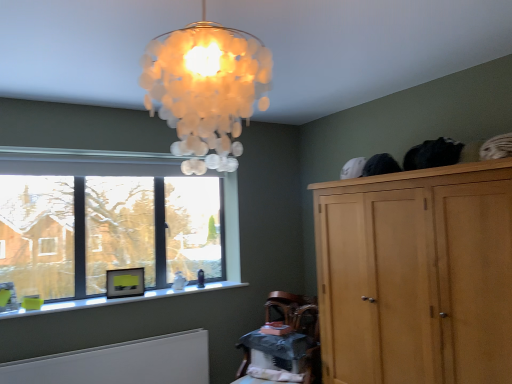
Question: From the image's perspective, does clear glass window at lower left appear lower than wooden armchair at lower center?

Choices:
 (A) yes
 (B) no

Answer: (B)

Question: Could you tell me if clear glass window at lower left is facing wooden armchair at lower center?

Choices:
 (A) yes
 (B) no

Answer: (B)

Question: Can we say clear glass window at lower left lies outside wooden armchair at lower center?

Choices:
 (A) no
 (B) yes

Answer: (B)

Question: From the image's perspective, is clear glass window at lower left on top of wooden armchair at lower center?

Choices:
 (A) yes
 (B) no

Answer: (A)

Question: Is clear glass window at lower left further to camera compared to wooden armchair at lower center?

Choices:
 (A) no
 (B) yes

Answer: (A)

Question: Would you say clear glass window at lower left is to the left or to the right of wooden armchair at lower center in the picture?

Choices:
 (A) left
 (B) right

Answer: (A)

Question: Is clear glass window at lower left inside the boundaries of wooden armchair at lower center, or outside?

Choices:
 (A) outside
 (B) inside

Answer: (A)

Question: From the image's perspective, is clear glass window at lower left positioned above or below wooden armchair at lower center?

Choices:
 (A) below
 (B) above

Answer: (B)

Question: Is point (39, 185) positioned closer to the camera than point (266, 299)?

Choices:
 (A) closer
 (B) farther

Answer: (A)

Question: Considering their positions, is translucent glass lampshade at upper center located in front of or behind white glossy frame at lower left?

Choices:
 (A) front
 (B) behind

Answer: (A)

Question: In terms of height, does translucent glass lampshade at upper center look taller or shorter compared to white glossy frame at lower left?

Choices:
 (A) tall
 (B) short

Answer: (A)

Question: Do you think translucent glass lampshade at upper center is within white glossy frame at lower left, or outside of it?

Choices:
 (A) inside
 (B) outside

Answer: (B)

Question: In terms of size, does translucent glass lampshade at upper center appear bigger or smaller than white glossy frame at lower left?

Choices:
 (A) small
 (B) big

Answer: (B)

Question: From the image's perspective, is clear glass window at lower left located above or below wooden table at lower center?

Choices:
 (A) below
 (B) above

Answer: (B)

Question: Would you say clear glass window at lower left is inside or outside wooden table at lower center?

Choices:
 (A) outside
 (B) inside

Answer: (A)